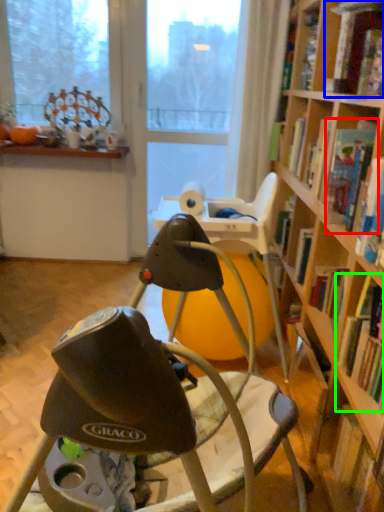
Question: Which object is positioned farthest from book (highlighted by a red box)? Select from book (highlighted by a blue box) and book (highlighted by a green box).

Choices:
 (A) book
 (B) book

Answer: (B)